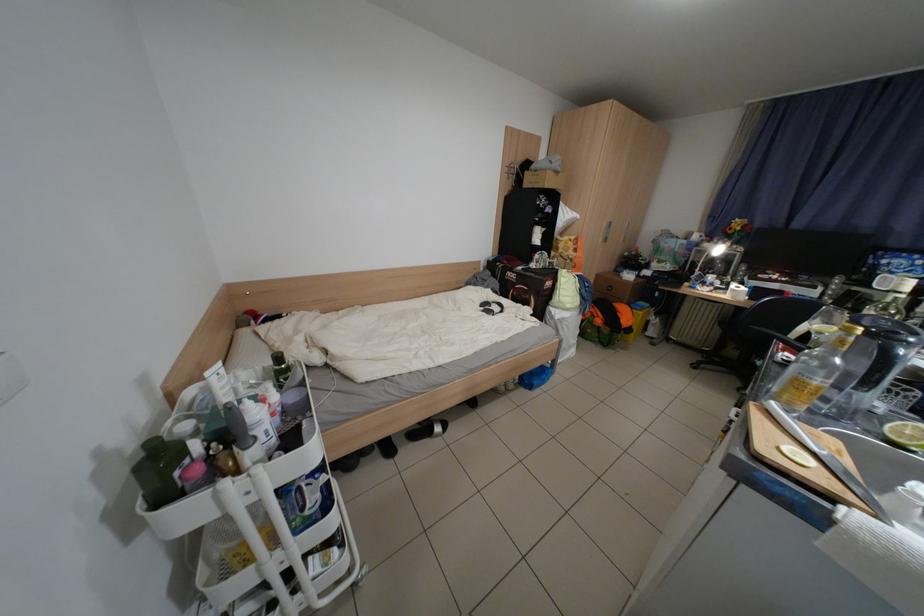
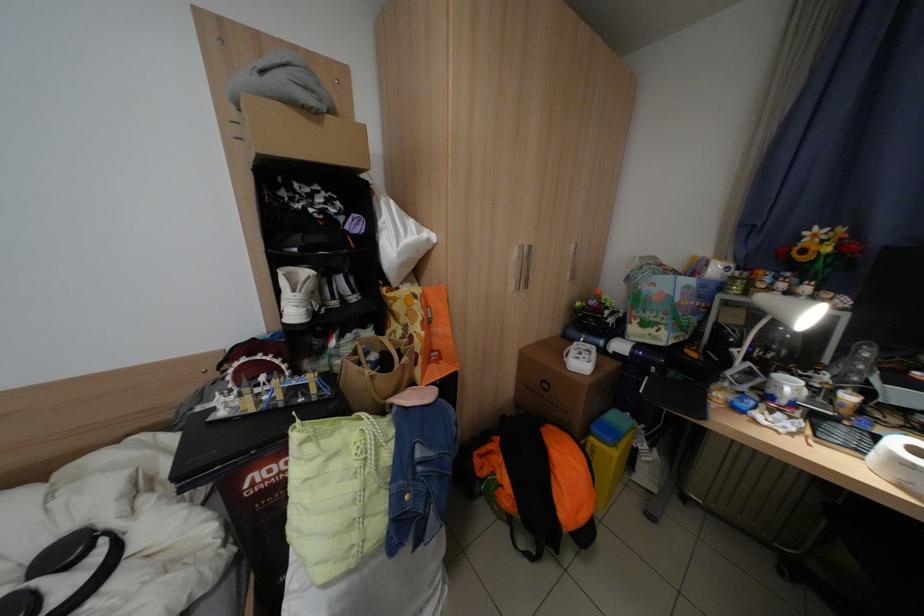
Find the pixel in the second image that matches point 723,278 in the first image.

(800, 387)